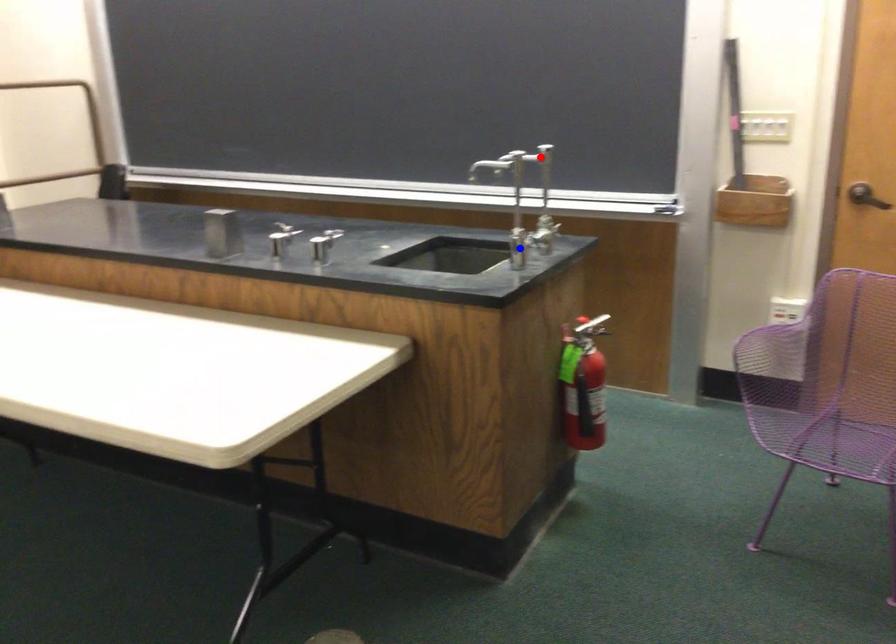
Question: Which of the two points in the image is closer to the camera?

Choices:
 (A) Blue point is closer.
 (B) Red point is closer.

Answer: (A)